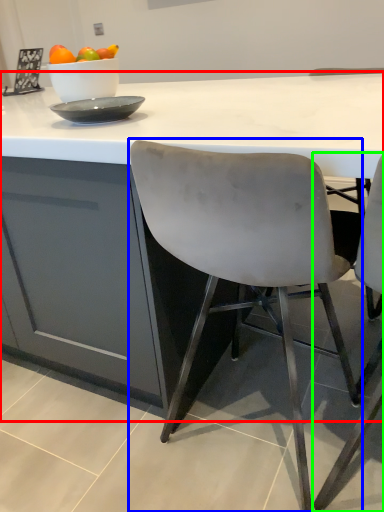
Question: Based on their relative distances, which object is nearer to table (highlighted by a red box)? Choose from chair (highlighted by a blue box) and chair (highlighted by a green box).

Choices:
 (A) chair
 (B) chair

Answer: (A)